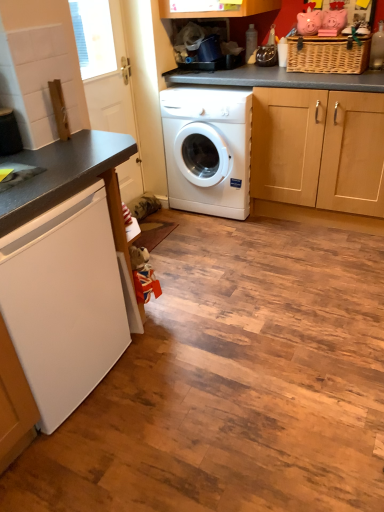
Image resolution: width=384 pixels, height=512 pixels. What are the coordinates of `vacant space to the right of white matte refrigerator at lower left, acting as the 1th washing machine starting from the front` in the screenshot? It's located at [172, 370].